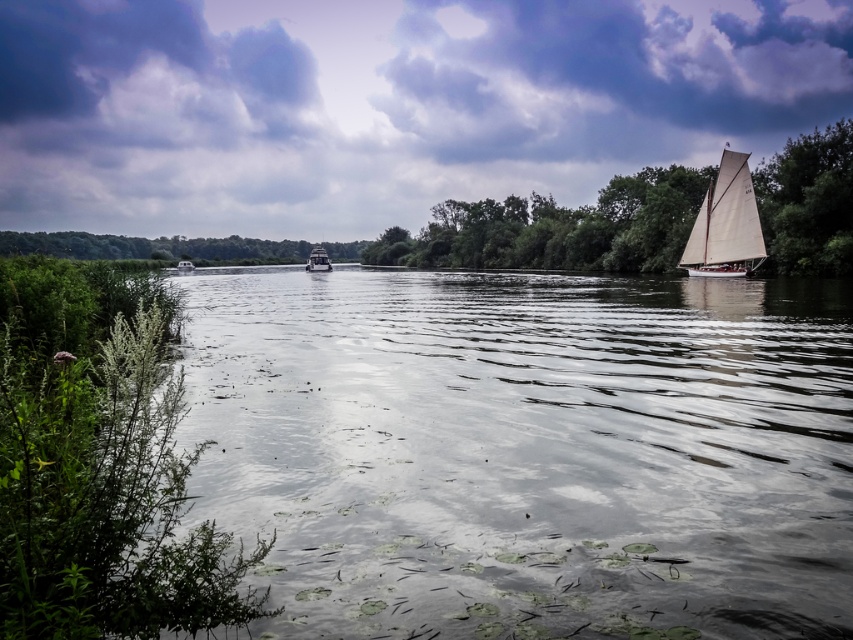
Is white canvas sailboat at right to the left of metallic gray boat at center from the viewer's perspective?

Incorrect, white canvas sailboat at right is not on the left side of metallic gray boat at center.

Find the location of a particular element. This screenshot has width=853, height=640. white canvas sailboat at right is located at coordinates (726, 225).

Does point (843, 333) come in front of point (527, 220)?

Yes.

Which is in front, point (364, 376) or point (831, 132)?

Positioned in front is point (364, 376).

Does point (834, 433) come in front of point (428, 225)?

Yes, point (834, 433) is in front of point (428, 225).

Locate an element on the screen. clear water at center is located at coordinates (527, 451).

Does metallic gray boat at center have a greater width compared to white plastic boat at center?

No, metallic gray boat at center is not wider than white plastic boat at center.

Is metallic gray boat at center positioned in front of white plastic boat at center?

Yes, metallic gray boat at center is closer to the viewer.

Between point (316, 257) and point (189, 260), which one is positioned behind?

Point (189, 260)

This screenshot has width=853, height=640. Identify the location of metallic gray boat at center. (317, 259).